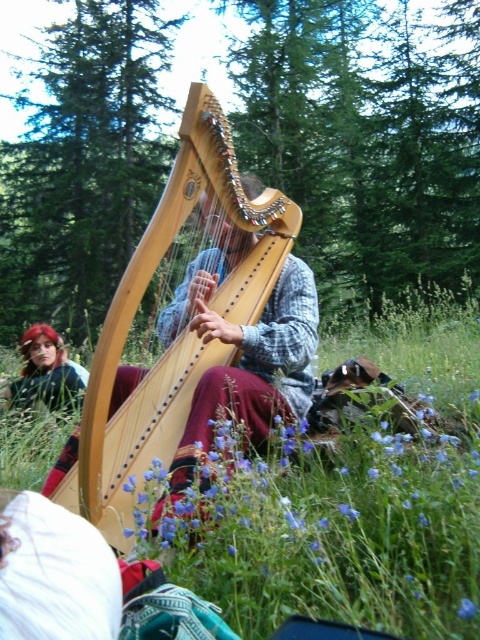
Question: Does shiny red hair at lower left appear over blue matte flower at center?

Choices:
 (A) no
 (B) yes

Answer: (B)

Question: Does natural wood harp at center lie in front of shiny red hair at lower left?

Choices:
 (A) no
 (B) yes

Answer: (B)

Question: Estimate the real-world distances between objects in this image. Which object is closer to the blue matte flower at center?

Choices:
 (A) green grass at center
 (B) natural wood harp at center

Answer: (B)

Question: Is the position of green grass at center more distant than that of blue matte flower at center?

Choices:
 (A) no
 (B) yes

Answer: (B)

Question: Which object is closer to the camera taking this photo?

Choices:
 (A) green grass at center
 (B) blue matte flower at center
 (C) natural wood harp at center
 (D) shiny red hair at lower left

Answer: (B)

Question: Which object appears farthest from the camera in this image?

Choices:
 (A) blue matte flower at center
 (B) natural wood harp at center
 (C) green grass at center

Answer: (B)